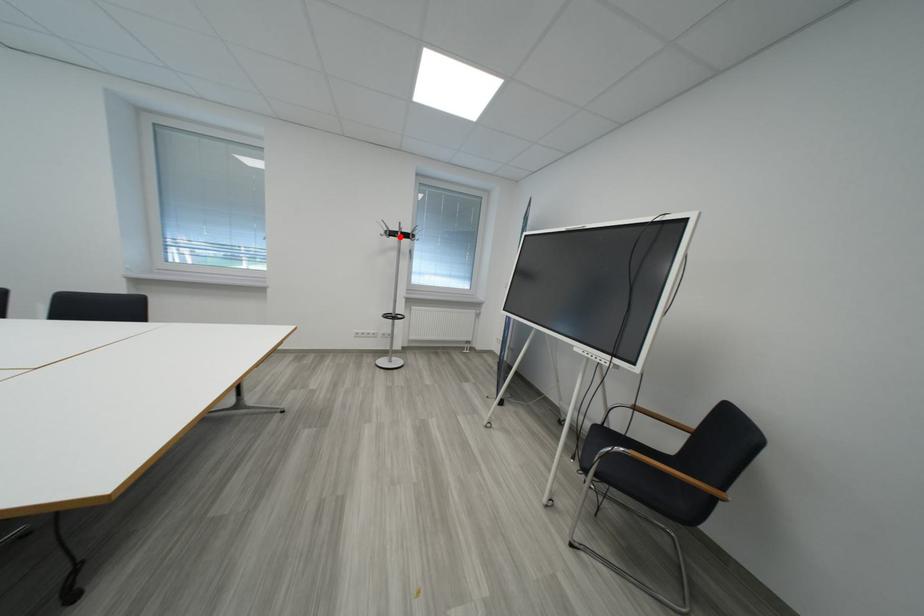
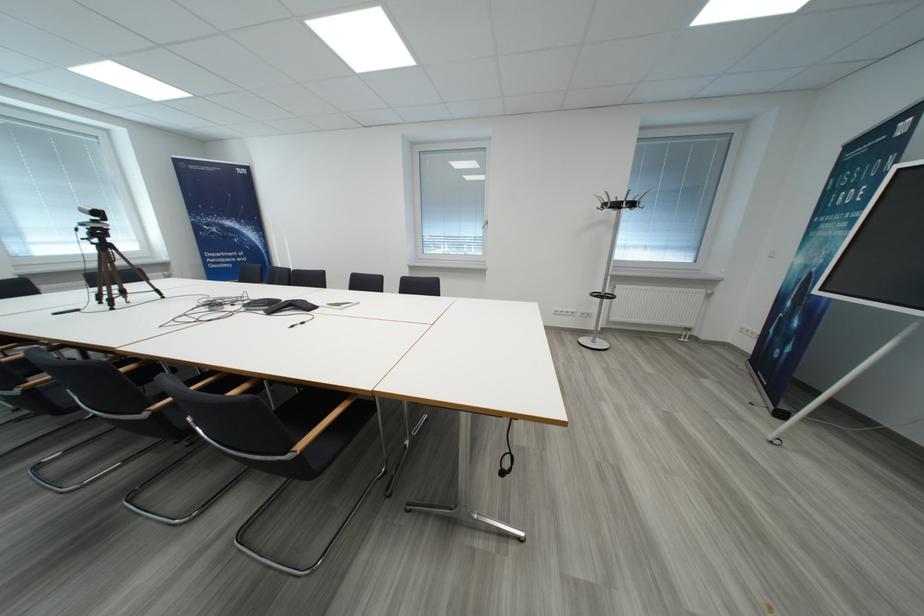
Where in the second image is the point corresponding to the highlighted location from the first image?

(623, 208)